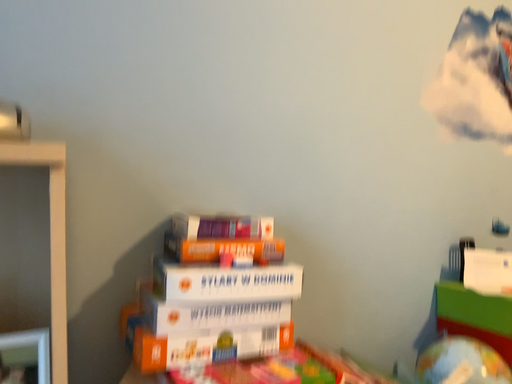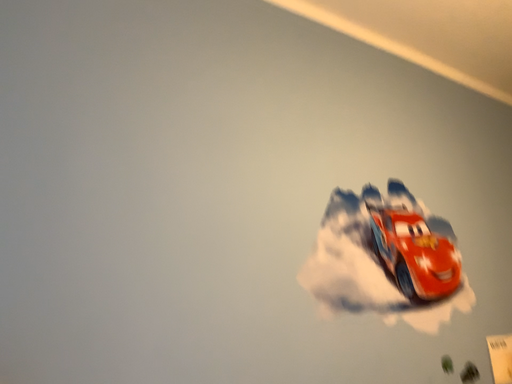
Question: How did the camera likely rotate when shooting the video?

Choices:
 (A) rotated left
 (B) rotated right

Answer: (B)